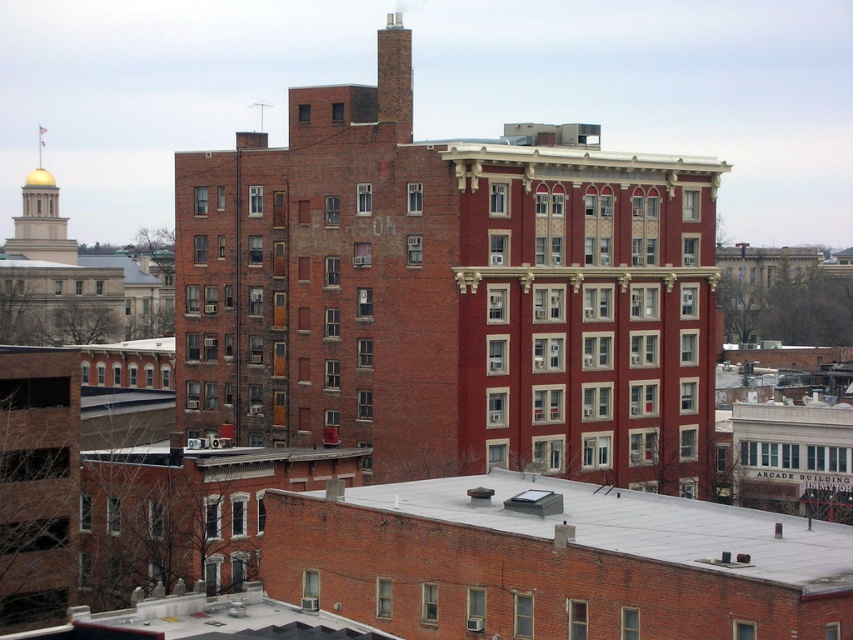
Does brick chimney at center lie in front of brick chimney at upper center?

Yes.

Is point (346, 358) more distant than point (393, 88)?

Yes, point (346, 358) is behind point (393, 88).

Locate an element on the screen. The height and width of the screenshot is (640, 853). brick chimney at center is located at coordinates (450, 298).